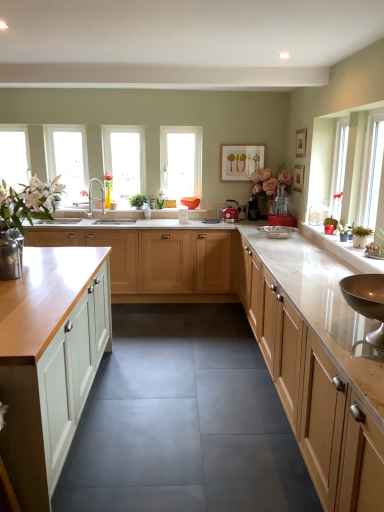
Question: Could you tell me if light wood cabinet at right, which is counted as the first cabinetry, starting from the right, is facing clear glass window at center, which is counted as the third window, starting from the left?

Choices:
 (A) yes
 (B) no

Answer: (B)

Question: Does light wood cabinet at right, which is counted as the first cabinetry, starting from the right, have a lesser height compared to clear glass window at center, which is counted as the third window, starting from the left?

Choices:
 (A) yes
 (B) no

Answer: (A)

Question: Is light wood cabinet at right, the third cabinetry when ordered from left to right, touching clear glass window at center, which is counted as the third window, starting from the left?

Choices:
 (A) no
 (B) yes

Answer: (A)

Question: Can you confirm if light wood cabinet at right, the third cabinetry when ordered from left to right, is positioned to the left of clear glass window at center, which is counted as the third window, starting from the left?

Choices:
 (A) no
 (B) yes

Answer: (A)

Question: From the image's perspective, is light wood cabinet at right, which is counted as the first cabinetry, starting from the right, located beneath clear glass window at center, which appears as the 1th window when viewed from the right?

Choices:
 (A) yes
 (B) no

Answer: (A)

Question: From a real-world perspective, is white matte vase at left above or below matte red kettle at center, which is counted as the second appliance, starting from the back?

Choices:
 (A) above
 (B) below

Answer: (A)

Question: Is white matte vase at left bigger or smaller than matte red kettle at center, the 1th appliance from the left?

Choices:
 (A) big
 (B) small

Answer: (A)

Question: Looking at their shapes, would you say white matte vase at left is wider or thinner than matte red kettle at center, which is counted as the second appliance, starting from the back?

Choices:
 (A) wide
 (B) thin

Answer: (A)

Question: From the image's perspective, is white matte vase at left positioned above or below matte red kettle at center, the 1th appliance from the left?

Choices:
 (A) below
 (B) above

Answer: (A)

Question: In terms of height, does light wood cabinet at center, acting as the 2th cabinetry starting from the left, look taller or shorter compared to matte red kettle at center, which ranks as the 2th appliance in front-to-back order?

Choices:
 (A) short
 (B) tall

Answer: (B)

Question: Considering the positions of light wood cabinet at center, acting as the 2th cabinetry starting from the left, and matte red kettle at center, the 1th appliance from the left, in the image, is light wood cabinet at center, acting as the 2th cabinetry starting from the left, bigger or smaller than matte red kettle at center, the 1th appliance from the left,?

Choices:
 (A) small
 (B) big

Answer: (B)

Question: Relative to matte red kettle at center, the 1th appliance from the left, is light wood cabinet at center, the 2th cabinetry when ordered from right to left, in front or behind?

Choices:
 (A) front
 (B) behind

Answer: (A)

Question: From the image's perspective, relative to matte red kettle at center, the 1th appliance from the left, is light wood cabinet at center, the 2th cabinetry when ordered from right to left, above or below?

Choices:
 (A) above
 (B) below

Answer: (B)

Question: In terms of height, does translucent glass window at center look taller or shorter compared to white painted wood cabinet at left, which ranks as the 3th cabinetry in right-to-left order?

Choices:
 (A) short
 (B) tall

Answer: (B)

Question: From the image's perspective, is translucent glass window at center above or below white painted wood cabinet at left, placed as the first cabinetry when sorted from left to right?

Choices:
 (A) below
 (B) above

Answer: (B)